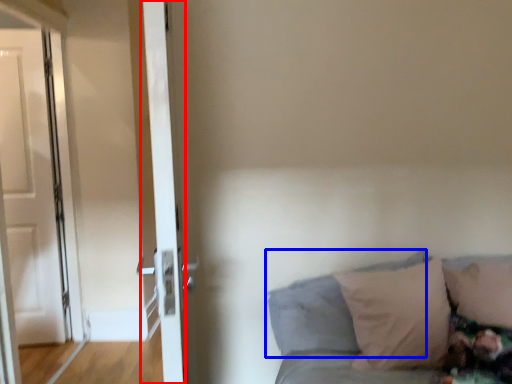
Question: Which object appears closest to the camera in this image, door (highlighted by a red box) or pillow (highlighted by a blue box)?

Choices:
 (A) door
 (B) pillow

Answer: (A)